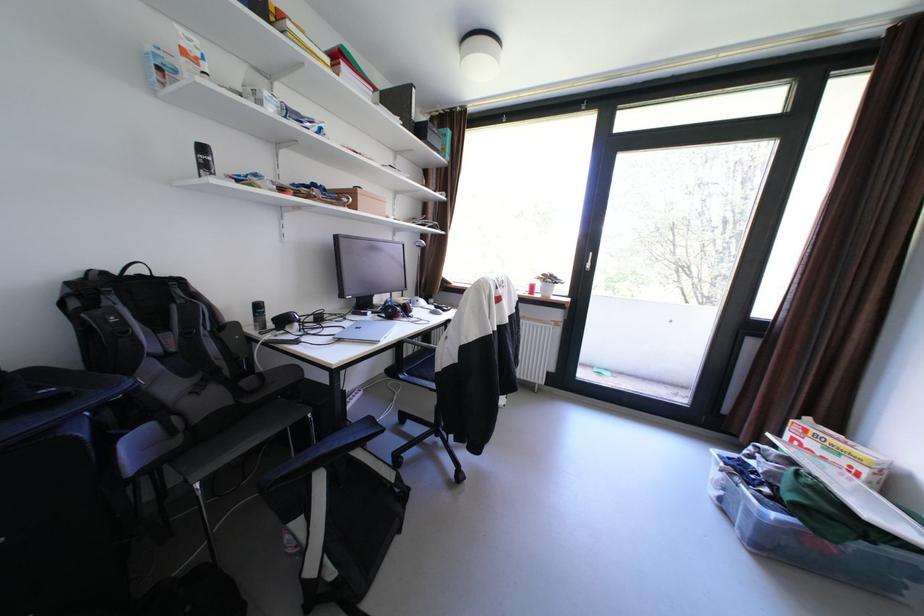
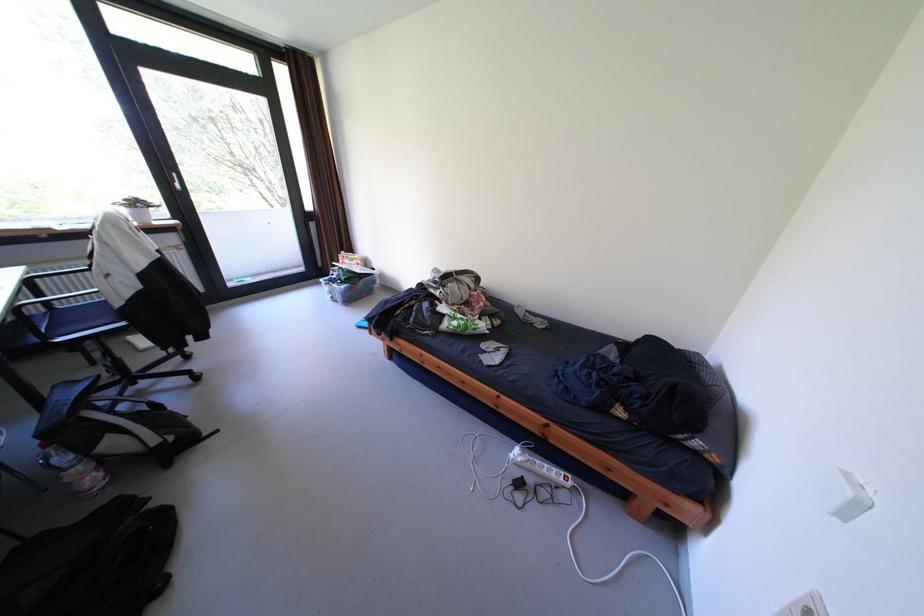
Where in the second image is the point corresponding to (561,280) from the first image?

(149, 205)